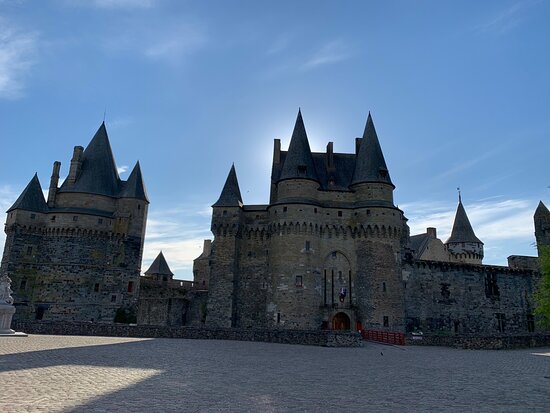
This screenshot has width=550, height=413. What are the coordinates of `sculpture` in the screenshot? It's located at (5, 284).